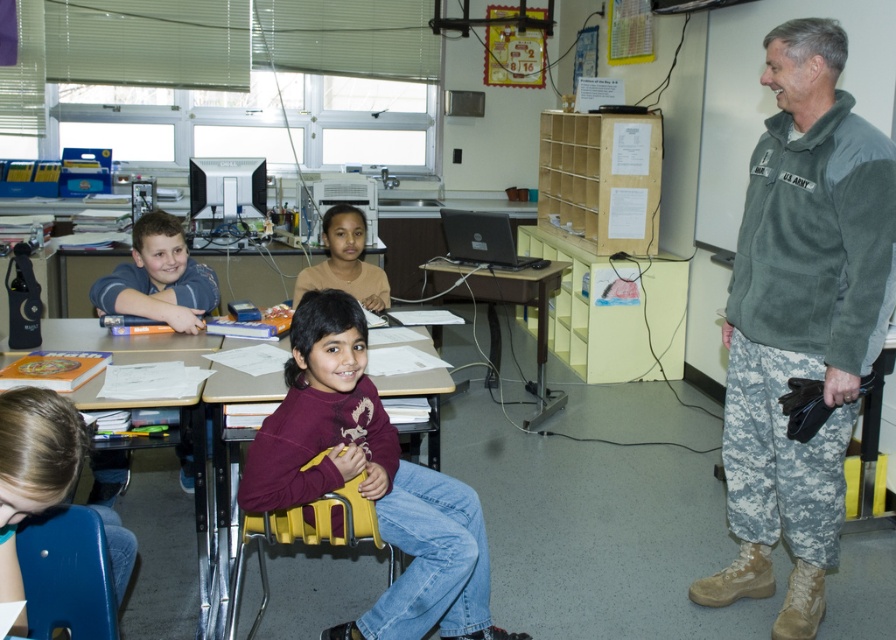
You are a teacher standing at the front of the classroom. You need to hand out a worksheet to the student wearing the maroon sweater at center and the student at the wooden desk at lower left. Which student is closer to the right side of the classroom?

The maroon sweater at center is to the right of the wooden desk at lower left, so the student wearing the maroon sweater at center is closer to the right side of the classroom.

Based on the photo, in the classroom scene, there is a child wearing a matte blue shirt at left and another child with a smooth skin face at center. Which child has a wider clothing item?

The matte blue shirt at left is wider than the smooth skin face at center, so the child wearing the matte blue shirt at left has a wider clothing item.